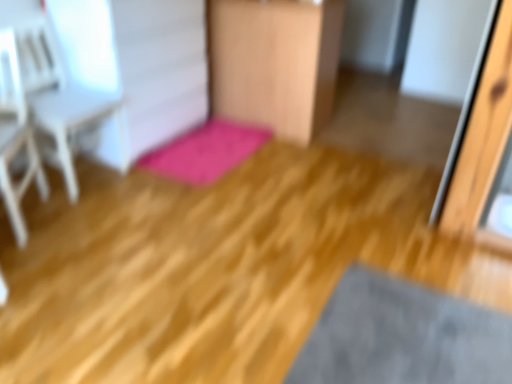
Question: From the image's perspective, would you say wooden chair at center is shown under pink plush bath mat at center?

Choices:
 (A) no
 (B) yes

Answer: (A)

Question: Does wooden chair at center have a greater height compared to pink plush bath mat at center?

Choices:
 (A) yes
 (B) no

Answer: (A)

Question: Is pink plush bath mat at center completely or partially inside wooden chair at center?

Choices:
 (A) yes
 (B) no

Answer: (B)

Question: Is wooden chair at center aimed at pink plush bath mat at center?

Choices:
 (A) yes
 (B) no

Answer: (B)

Question: From a real-world perspective, is wooden chair at center positioned over pink plush bath mat at center based on gravity?

Choices:
 (A) no
 (B) yes

Answer: (B)

Question: From a real-world perspective, is wooden chair at center positioned under pink plush bath mat at center based on gravity?

Choices:
 (A) no
 (B) yes

Answer: (A)

Question: Can you confirm if white wood armchair at left, the 1th armchair from the front, is positioned to the left of pink plush bath mat at center?

Choices:
 (A) no
 (B) yes

Answer: (B)

Question: Is white wood armchair at left, which is the 2th armchair from back to front, outside of pink plush bath mat at center?

Choices:
 (A) yes
 (B) no

Answer: (A)

Question: Is white wood armchair at left, which is the 2th armchair from back to front, wider than pink plush bath mat at center?

Choices:
 (A) yes
 (B) no

Answer: (B)

Question: Does white wood armchair at left, the 1th armchair from the front, have a lesser height compared to pink plush bath mat at center?

Choices:
 (A) no
 (B) yes

Answer: (A)

Question: From the image's perspective, is white wood armchair at left, which is the 2th armchair from back to front, under pink plush bath mat at center?

Choices:
 (A) yes
 (B) no

Answer: (A)

Question: Is white wood armchair at left, the 1th armchair from the front, facing towards pink plush bath mat at center?

Choices:
 (A) no
 (B) yes

Answer: (A)

Question: Considering the relative sizes of white wood armchair at upper left, placed as the first armchair when sorted from back to front, and wooden chair at center in the image provided, is white wood armchair at upper left, placed as the first armchair when sorted from back to front, shorter than wooden chair at center?

Choices:
 (A) no
 (B) yes

Answer: (B)